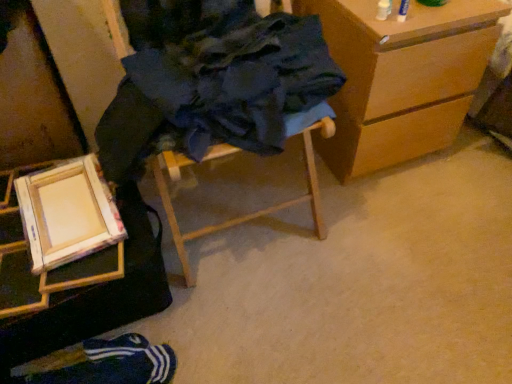
Question: Is wooden chest of drawers at right far from wooden easel at lower left, which is the 2th furniture in right-to-left order?

Choices:
 (A) yes
 (B) no

Answer: (B)

Question: Does wooden chest of drawers at right contain wooden easel at lower left, the first furniture viewed from the left?

Choices:
 (A) no
 (B) yes

Answer: (A)

Question: Is wooden chest of drawers at right oriented towards wooden easel at lower left, the first furniture viewed from the left?

Choices:
 (A) no
 (B) yes

Answer: (A)

Question: Is wooden chest of drawers at right at the left side of wooden easel at lower left, the first furniture viewed from the left?

Choices:
 (A) yes
 (B) no

Answer: (B)

Question: From the image's perspective, is wooden chest of drawers at right above wooden easel at lower left, which is the 2th furniture in right-to-left order?

Choices:
 (A) yes
 (B) no

Answer: (A)

Question: Looking at the image, does wooden frame at lower left seem bigger or smaller compared to blue fabric socks at lower left?

Choices:
 (A) small
 (B) big

Answer: (A)

Question: From the image's perspective, is wooden frame at lower left above or below blue fabric socks at lower left?

Choices:
 (A) below
 (B) above

Answer: (B)

Question: Is point (119, 221) closer or farther from the camera than point (123, 339)?

Choices:
 (A) farther
 (B) closer

Answer: (B)

Question: From their relative heights in the image, would you say wooden frame at lower left is taller or shorter than blue fabric socks at lower left?

Choices:
 (A) tall
 (B) short

Answer: (B)

Question: Is wooden chest of drawers at right inside the boundaries of wooden frame at lower left, or outside?

Choices:
 (A) outside
 (B) inside

Answer: (A)

Question: Is wooden chest of drawers at right wider or thinner than wooden frame at lower left?

Choices:
 (A) thin
 (B) wide

Answer: (B)

Question: From their relative heights in the image, would you say wooden chest of drawers at right is taller or shorter than wooden frame at lower left?

Choices:
 (A) tall
 (B) short

Answer: (A)

Question: From the image's perspective, is wooden chest of drawers at right located above or below wooden frame at lower left?

Choices:
 (A) above
 (B) below

Answer: (A)

Question: Is wooden folding chair at center, positioned as the second furniture in left-to-right order, bigger or smaller than wooden frame at lower left?

Choices:
 (A) big
 (B) small

Answer: (A)

Question: From the image's perspective, is wooden folding chair at center, the first furniture from the right, above or below wooden frame at lower left?

Choices:
 (A) above
 (B) below

Answer: (A)